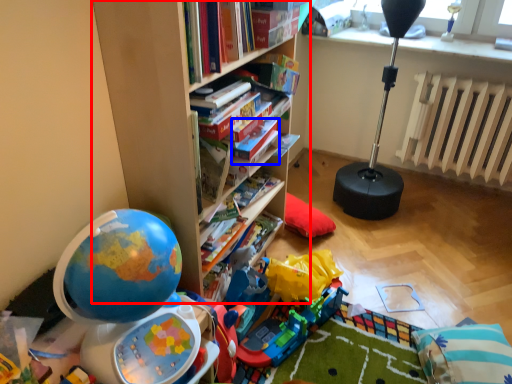
Question: Which point is further to the camera, bookcase (highlighted by a red box) or paperback book (highlighted by a blue box)?

Choices:
 (A) bookcase
 (B) paperback book

Answer: (B)